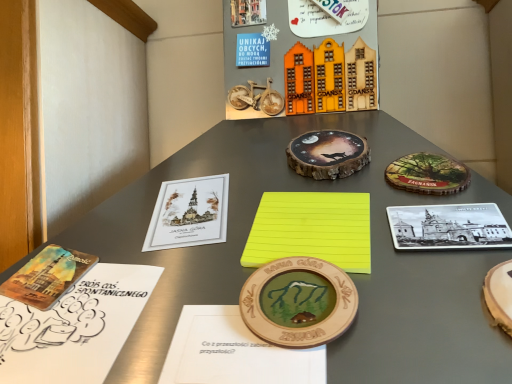
Question: Considering the relative sizes of wooden toy houses at upper center and wooden medallion at center, the 1th coin when ordered from front to back, in the image provided, is wooden toy houses at upper center bigger than wooden medallion at center, the 1th coin when ordered from front to back,?

Choices:
 (A) no
 (B) yes

Answer: (A)

Question: From the image's perspective, is wooden toy houses at upper center on top of wooden medallion at center, acting as the second coin starting from the back?

Choices:
 (A) yes
 (B) no

Answer: (A)

Question: From a real-world perspective, is wooden toy houses at upper center over wooden medallion at center, acting as the second coin starting from the back?

Choices:
 (A) no
 (B) yes

Answer: (B)

Question: Is wooden toy houses at upper center facing away from wooden medallion at center, the second coin from the top?

Choices:
 (A) no
 (B) yes

Answer: (A)

Question: Could you tell me if wooden toy houses at upper center is facing wooden medallion at center, the 1th coin when ordered from front to back?

Choices:
 (A) yes
 (B) no

Answer: (B)

Question: From the image's perspective, is wooden toy houses at upper center below wooden medallion at center, the 1th coin when ordered from front to back?

Choices:
 (A) yes
 (B) no

Answer: (B)

Question: Is wooden notebook at center, acting as the 2th notebook starting from the right, located within yellow matte paper at center?

Choices:
 (A) no
 (B) yes

Answer: (B)

Question: Does yellow matte paper at center have a lesser width compared to wooden notebook at center, acting as the 2th notebook starting from the right?

Choices:
 (A) no
 (B) yes

Answer: (A)

Question: From the image's perspective, is yellow matte paper at center over wooden notebook at center, placed as the second notebook when sorted from left to right?

Choices:
 (A) no
 (B) yes

Answer: (B)

Question: Is yellow matte paper at center in front of wooden notebook at center, placed as the second notebook when sorted from left to right?

Choices:
 (A) no
 (B) yes

Answer: (B)

Question: Is yellow matte paper at center outside wooden notebook at center, placed as the second notebook when sorted from left to right?

Choices:
 (A) yes
 (B) no

Answer: (A)

Question: Is yellow matte paper at center looking in the opposite direction of wooden notebook at center, placed as the second notebook when sorted from left to right?

Choices:
 (A) yes
 (B) no

Answer: (B)

Question: Can you confirm if yellow matte paper at center is shorter than yellow paper at center, acting as the third notebook starting from the left?

Choices:
 (A) yes
 (B) no

Answer: (B)